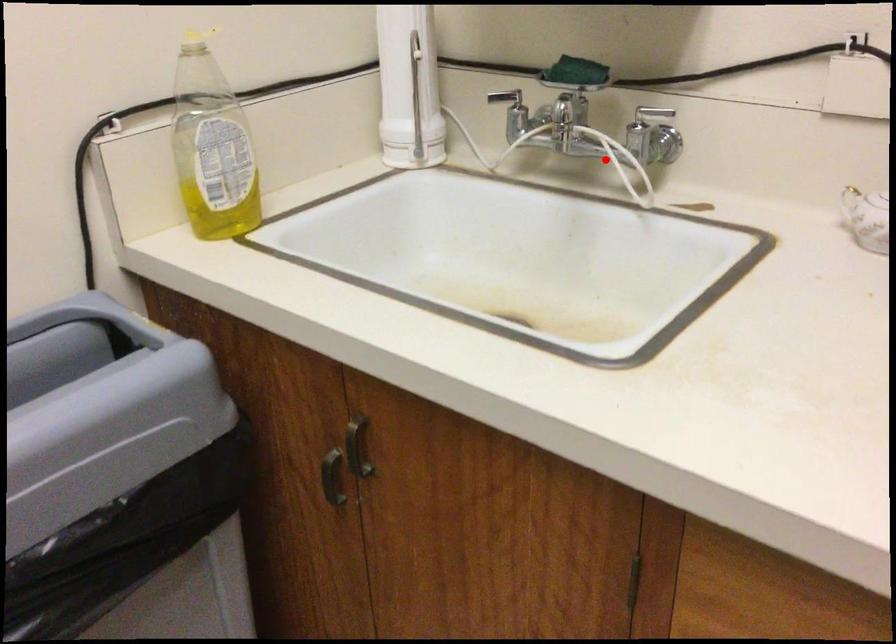
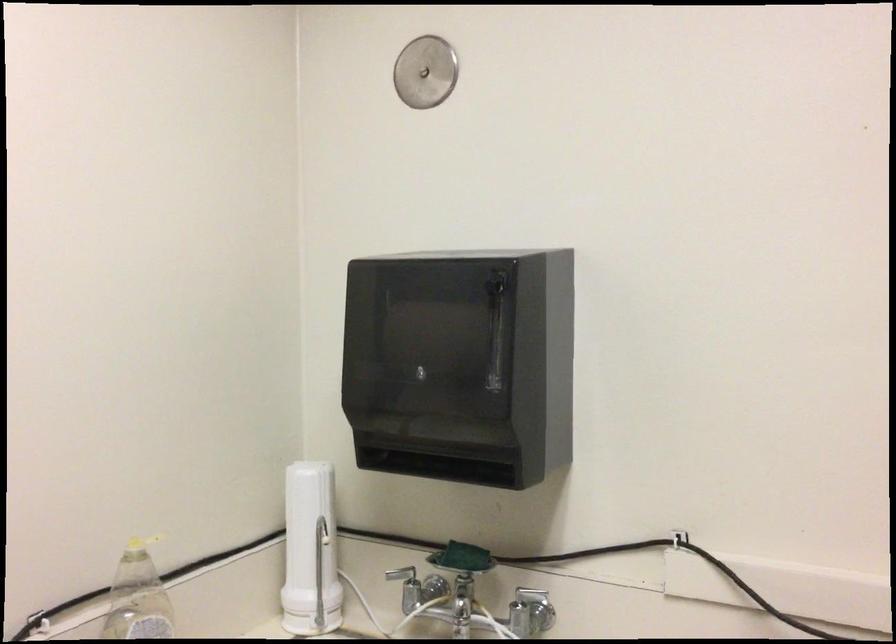
The point at the highlighted location is marked in the first image. Where is the corresponding point in the second image?

(490, 621)